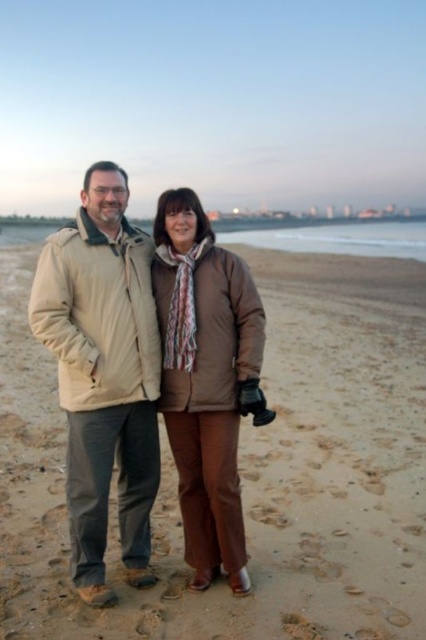
Question: Which point appears closest to the camera in this image?

Choices:
 (A) (147, 326)
 (B) (34, 392)

Answer: (A)

Question: Based on their relative distances, which object is farther from the brown matte jacket at center?

Choices:
 (A) brown sand at center
 (B) beige fabric jacket at center

Answer: (A)

Question: Can you confirm if brown sand at center is positioned above beige fabric jacket at center?

Choices:
 (A) yes
 (B) no

Answer: (A)

Question: Can you confirm if brown sand at center is thinner than beige fabric jacket at center?

Choices:
 (A) yes
 (B) no

Answer: (B)

Question: Considering the real-world distances, which object is farthest from the brown matte jacket at center?

Choices:
 (A) brown sand at center
 (B) beige fabric jacket at center

Answer: (A)

Question: Is brown sand at center positioned at the back of brown matte jacket at center?

Choices:
 (A) no
 (B) yes

Answer: (A)